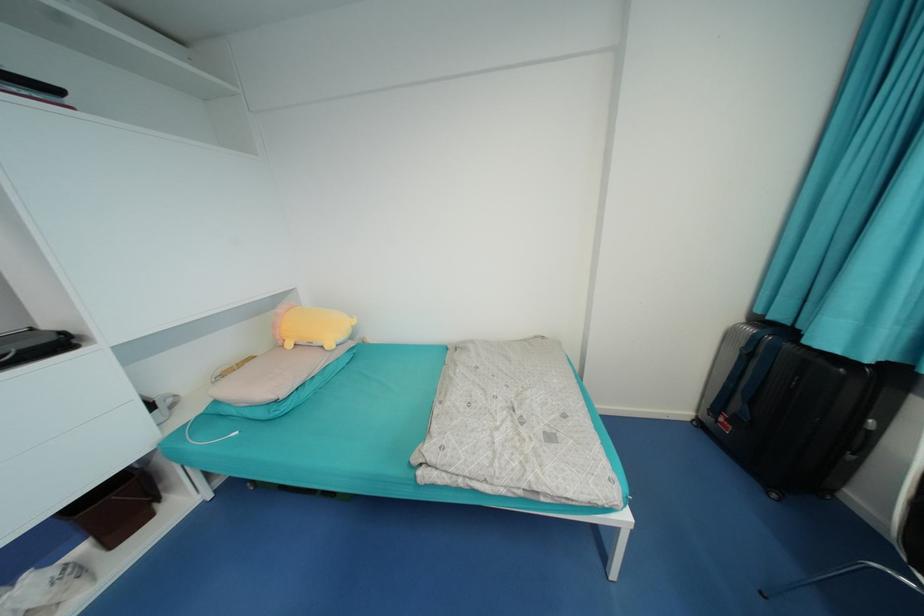
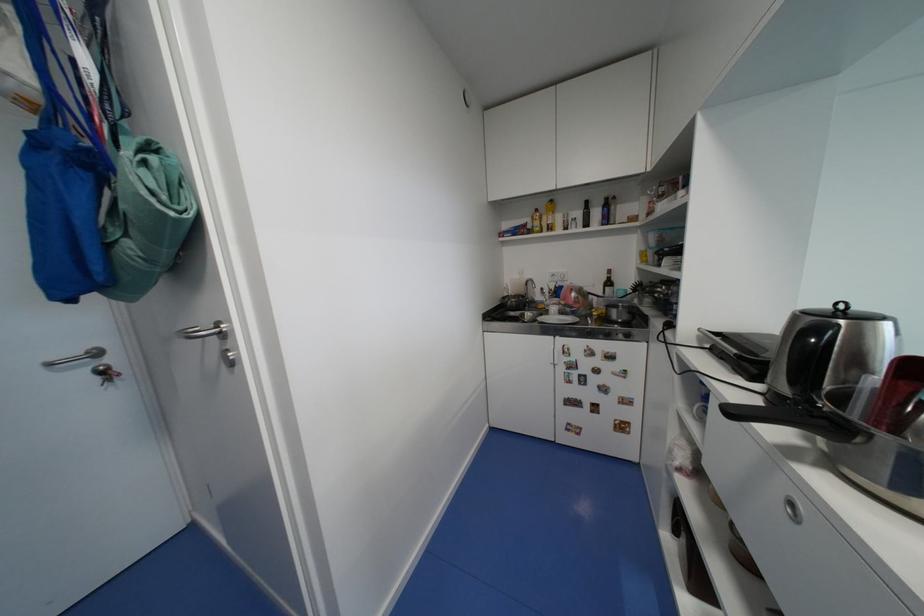
Question: The images are taken continuously from a first-person perspective. In which direction are you moving?

Choices:
 (A) Left
 (B) Right
 (C) Forward
 (D) Backward

Answer: (A)